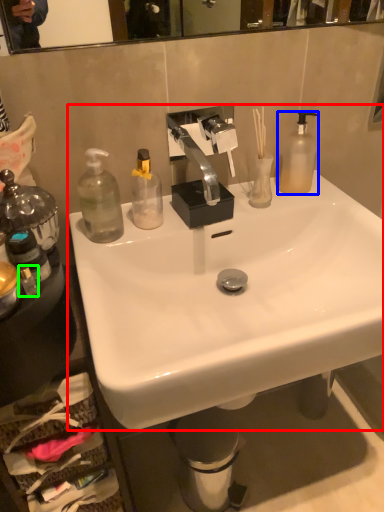
Question: Based on their relative distances, which object is nearer to sink (highlighted by a red box)? Choose from bottle (highlighted by a blue box) and bottle (highlighted by a green box).

Choices:
 (A) bottle
 (B) bottle

Answer: (A)